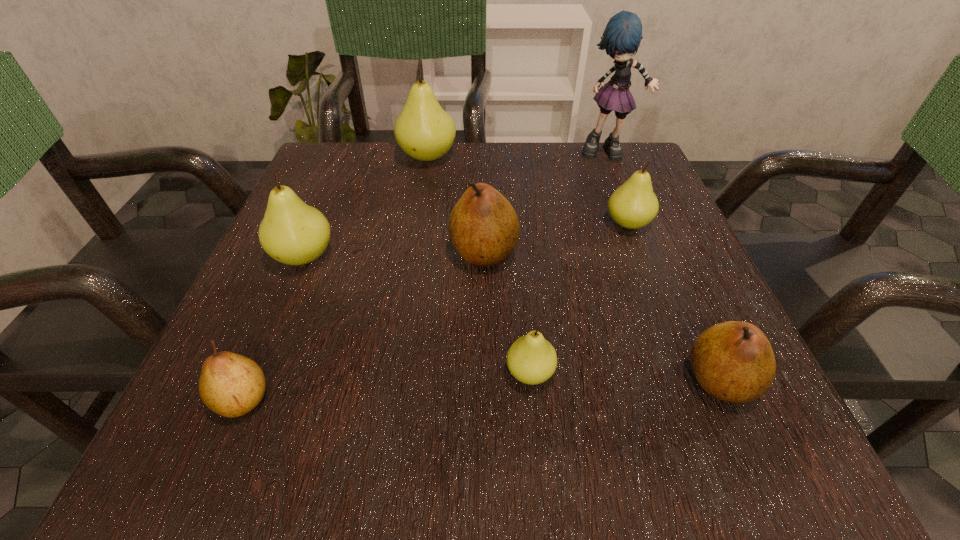
The width and height of the screenshot is (960, 540). I want to click on rag doll at the far edge, so click(x=621, y=38).

Identify the location of pear that is positioned at the far edge. The width and height of the screenshot is (960, 540). (424, 131).

Image resolution: width=960 pixels, height=540 pixels. Identify the location of rag doll present at the right edge. (621, 38).

Where is `object located in the near left corner section of the desktop`? Image resolution: width=960 pixels, height=540 pixels. object located in the near left corner section of the desktop is located at coordinates (231, 385).

This screenshot has height=540, width=960. Find the location of `object that is at the far right corner`. object that is at the far right corner is located at coordinates (621, 38).

You are a GUI agent. You are given a task and a screenshot of the screen. Output one action in this format:
    pyautogui.click(x=<x>, y=<y>)
    Task: Click on the object that is positioned at the near right corner
    
    Given the screenshot: What is the action you would take?
    pyautogui.click(x=733, y=361)

The height and width of the screenshot is (540, 960). In the image, there is a desktop. Find the location of `vacant region at the far edge`. vacant region at the far edge is located at coordinates (463, 154).

Image resolution: width=960 pixels, height=540 pixels. In the image, there is a desktop. Identify the location of free space at the near edge. (592, 414).

This screenshot has height=540, width=960. In order to click on free space at the left edge of the desktop in this screenshot , I will do `click(282, 273)`.

This screenshot has width=960, height=540. What are the coordinates of `vacant space at the right edge of the desktop` in the screenshot? It's located at (603, 256).